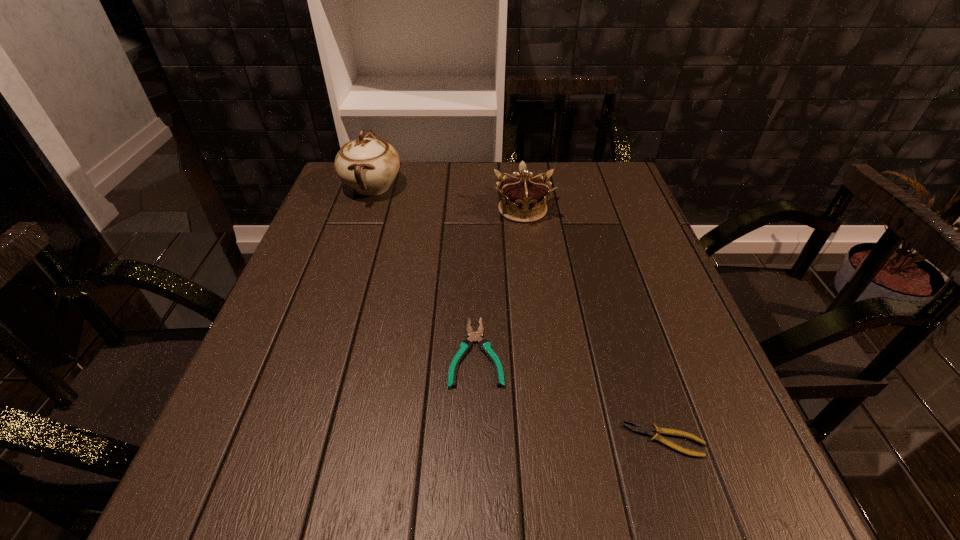
Locate an element on the screen. The image size is (960, 540). the tallest object is located at coordinates (368, 165).

Find the location of a particular element. The width and height of the screenshot is (960, 540). chinaware is located at coordinates (368, 165).

Identify the location of crown. (523, 197).

You are a GUI agent. You are given a task and a screenshot of the screen. Output one action in this format:
    pyautogui.click(x=<x>, y=<y>)
    Task: Click on the second nearest object
    
    Given the screenshot: What is the action you would take?
    pyautogui.click(x=465, y=346)

Locate an element on the screen. the left pliers is located at coordinates (465, 346).

You are a GUI agent. You are given a task and a screenshot of the screen. Output one action in this format:
    pyautogui.click(x=<x>, y=<y>)
    Task: Click on the rightmost object
    The image size is (960, 540).
    Given the screenshot: What is the action you would take?
    pyautogui.click(x=643, y=429)

Locate an element on the screen. the right pliers is located at coordinates (643, 429).

At what (x,y) coordinates should I click in order to perform the action: click on free spot located 0.200m on the right of the chinaware. Please return your answer as a coordinate pair (x, y). The height and width of the screenshot is (540, 960). Looking at the image, I should click on (474, 187).

I want to click on vacant space situated on the front of the second tallest object, so point(529,261).

Where is `free space located 0.190m on the back of the farther pliers`? The height and width of the screenshot is (540, 960). free space located 0.190m on the back of the farther pliers is located at coordinates (477, 258).